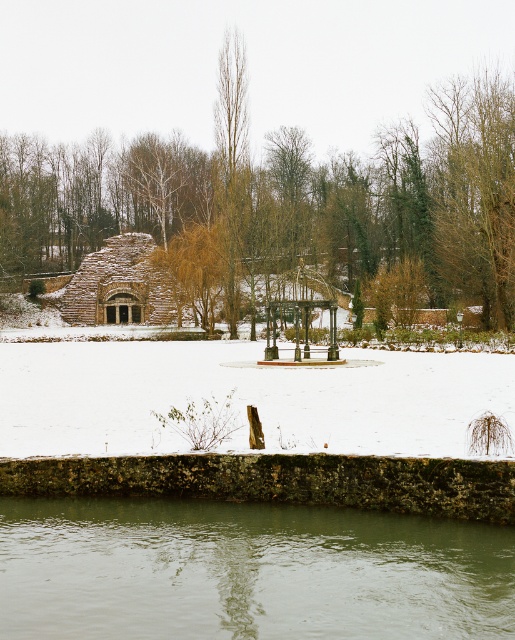
Question: Does rustic stone hut at center appear on the left side of bare wood tree at center?

Choices:
 (A) yes
 (B) no

Answer: (A)

Question: Estimate the real-world distances between objects in this image. Which object is closer to the greenish water at lower center?

Choices:
 (A) bare wood tree at center
 (B) bare wood tree at right
 (C) rustic stone hut at center

Answer: (A)

Question: Is brown textured tree at center in front of bare wood tree at center?

Choices:
 (A) no
 (B) yes

Answer: (B)

Question: Can you confirm if white powdery snow at center is positioned above wooden gazebo at center?

Choices:
 (A) no
 (B) yes

Answer: (A)

Question: Among these points, which one is farthest from the camera?

Choices:
 (A) (118, 246)
 (B) (77, 445)
 (C) (227, 285)

Answer: (A)

Question: Which of these objects is positioned closest to the greenish water at lower center?

Choices:
 (A) wooden gazebo at center
 (B) bare wood tree at center

Answer: (A)